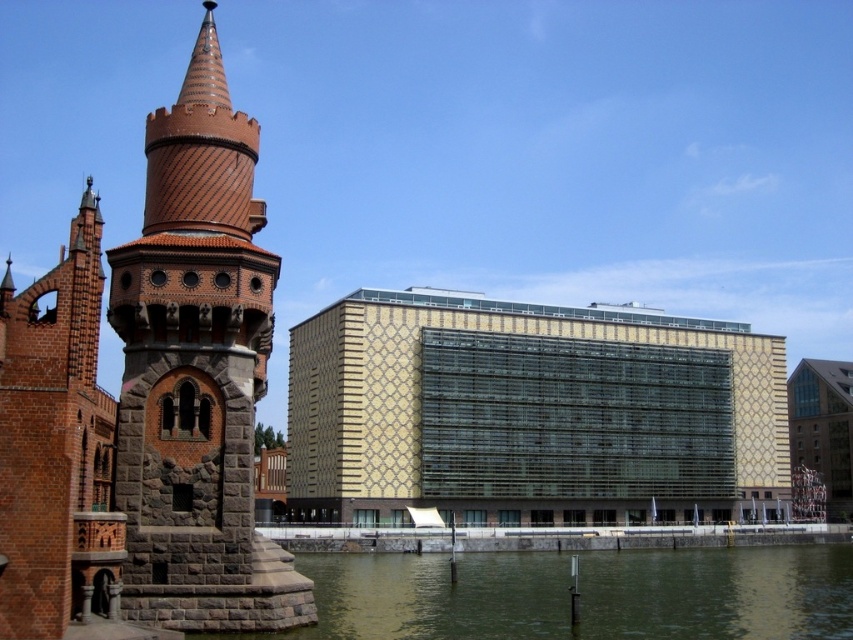
Question: Can you confirm if brown textured stone tower at left is positioned to the right of greenish water at lower center?

Choices:
 (A) no
 (B) yes

Answer: (A)

Question: Among these points, which one is nearest to the camera?

Choices:
 (A) (393, 564)
 (B) (222, 376)

Answer: (B)

Question: Is brown textured stone tower at left smaller than greenish water at lower center?

Choices:
 (A) yes
 (B) no

Answer: (A)

Question: Is brown textured stone tower at left bigger than greenish water at lower center?

Choices:
 (A) yes
 (B) no

Answer: (B)

Question: Which point is farther to the camera?

Choices:
 (A) (207, 516)
 (B) (421, 611)

Answer: (B)